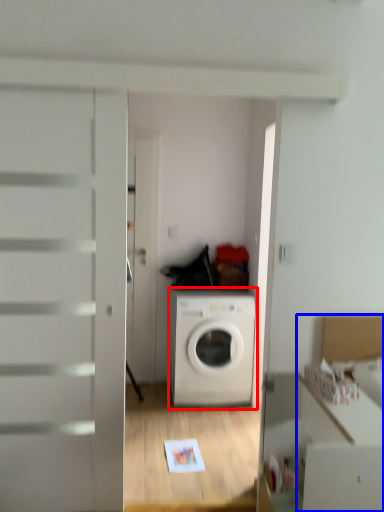
Question: Which object is further to the camera taking this photo, washing machine (highlighted by a red box) or cabinetry (highlighted by a blue box)?

Choices:
 (A) washing machine
 (B) cabinetry

Answer: (A)